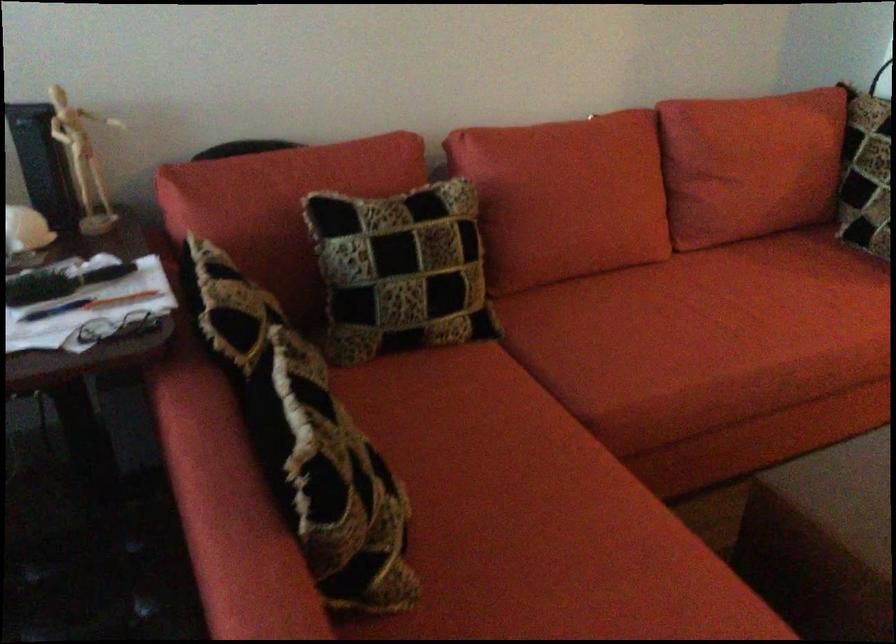
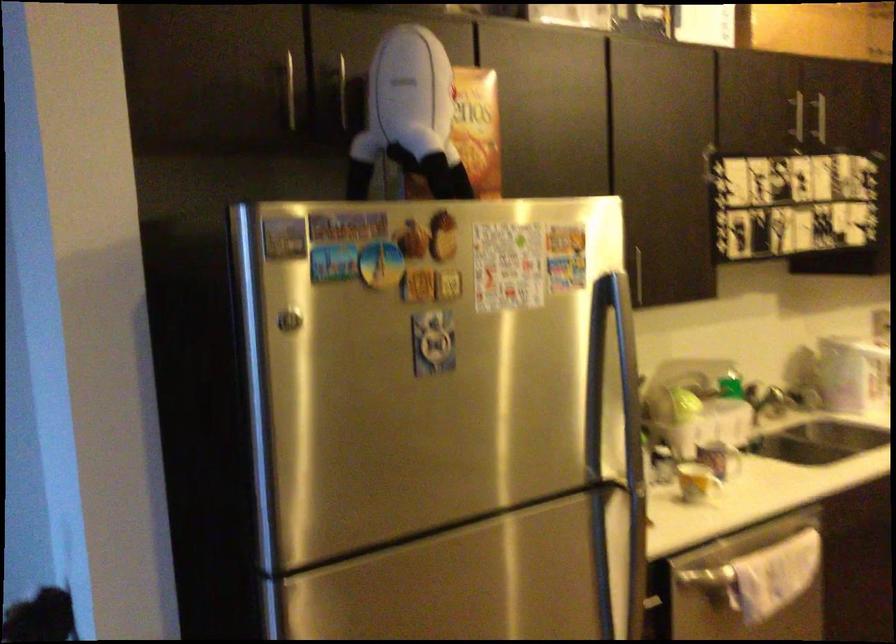
In a continuous first-person perspective shot, in which direction is the camera moving?

The cameraman moved toward right, forward.